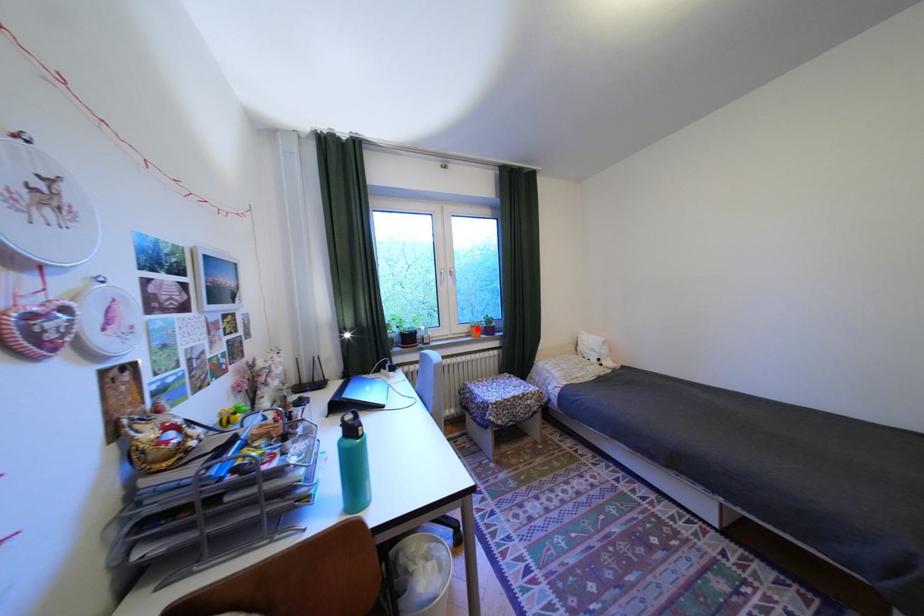
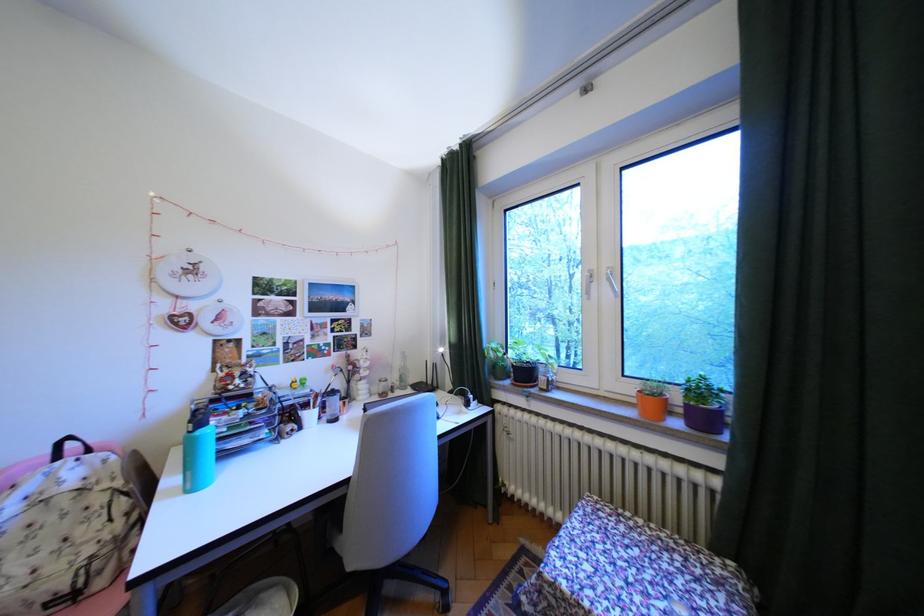
The point at the highlighted location is marked in the first image. Where is the corresponding point in the second image?

(641, 390)